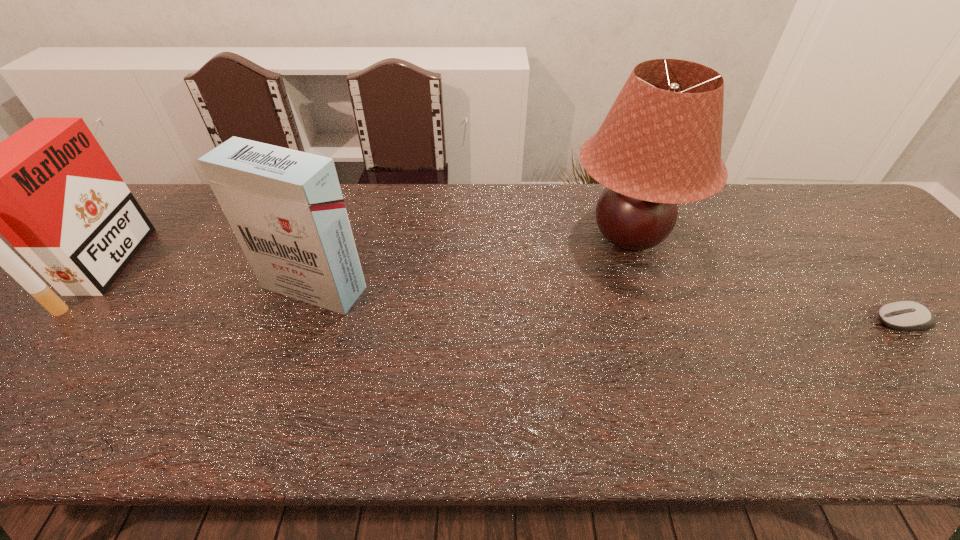
This screenshot has height=540, width=960. I want to click on unoccupied position between the lampshade and the left cigarette case, so click(367, 252).

This screenshot has width=960, height=540. Identify the location of vacant area that lies between the left cigarette case and the second object from left to right. (209, 278).

Find the location of a particular element. free spot between the second object from right to left and the leftmost object is located at coordinates (367, 252).

Find the location of a particular element. object that is the second closest one to the lampshade is located at coordinates (285, 207).

Identify the location of object identified as the third closest to the second object from left to right. (903, 315).

What are the coordinates of `blank space that satisfies the following two spatial constraints: 1. on the front-facing side of the left cigarette case; 2. on the back side of the second object from left to right` in the screenshot? It's located at (89, 287).

In order to click on free space that satisfies the following two spatial constraints: 1. on the back side of the right cigarette case; 2. on the front-facing side of the left cigarette case in this screenshot , I will do `click(321, 268)`.